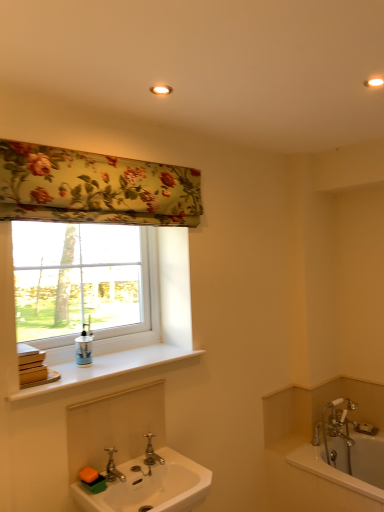
Question: Can you confirm if white glossy sink at lower left is positioned to the left of white plastic window at upper left?

Choices:
 (A) yes
 (B) no

Answer: (B)

Question: Is white glossy sink at lower left not inside white plastic window at upper left?

Choices:
 (A) yes
 (B) no

Answer: (A)

Question: Considering the relative sizes of white glossy sink at lower left and white plastic window at upper left in the image provided, is white glossy sink at lower left shorter than white plastic window at upper left?

Choices:
 (A) yes
 (B) no

Answer: (A)

Question: Would you say white glossy sink at lower left contains white plastic window at upper left?

Choices:
 (A) no
 (B) yes

Answer: (A)

Question: Does white glossy sink at lower left come in front of white plastic window at upper left?

Choices:
 (A) yes
 (B) no

Answer: (A)

Question: Could you tell me if white glossy sink at lower left is turned towards white plastic window at upper left?

Choices:
 (A) yes
 (B) no

Answer: (B)

Question: Could you tell me if chrome metallic faucet at lower center, which is counted as the first tap, starting from the left, is turned towards polished brass faucet at sink center, placed as the 1th tap when sorted from back to front?

Choices:
 (A) no
 (B) yes

Answer: (A)

Question: From the image's perspective, is chrome metallic faucet at lower center, the 2th tap positioned from the right, located above polished brass faucet at sink center, acting as the first tap starting from the right?

Choices:
 (A) no
 (B) yes

Answer: (A)

Question: Is chrome metallic faucet at lower center, the 2th tap positioned from the right, in front of polished brass faucet at sink center, placed as the 1th tap when sorted from back to front?

Choices:
 (A) yes
 (B) no

Answer: (A)

Question: Can you confirm if chrome metallic faucet at lower center, the 2th tap when ordered from back to front, is positioned to the right of polished brass faucet at sink center, placed as the 1th tap when sorted from back to front?

Choices:
 (A) yes
 (B) no

Answer: (B)

Question: Would you say chrome metallic faucet at lower center, the 2th tap positioned from the right, is a long distance from polished brass faucet at sink center, acting as the second tap starting from the front?

Choices:
 (A) yes
 (B) no

Answer: (B)

Question: From the image's perspective, is chrome metallic faucet at lower center, the 1th tap from the front, below polished brass faucet at sink center, placed as the 1th tap when sorted from back to front?

Choices:
 (A) no
 (B) yes

Answer: (B)

Question: Is white plastic window at upper left closer to the viewer compared to polished brass faucet at sink center, the 2th tap in the left-to-right sequence?

Choices:
 (A) yes
 (B) no

Answer: (B)